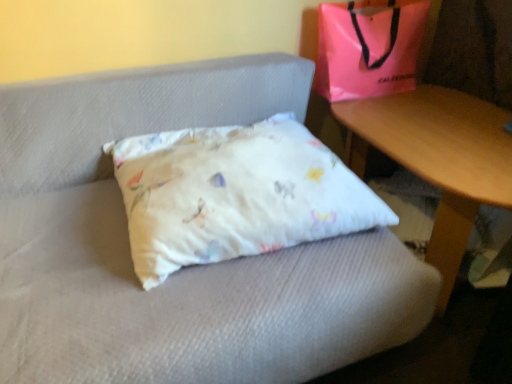
Question: Considering the relative sizes of wooden table at lower right and white cotton pillow at center in the image provided, is wooden table at lower right bigger than white cotton pillow at center?

Choices:
 (A) yes
 (B) no

Answer: (A)

Question: From a real-world perspective, is wooden table at lower right located beneath white cotton pillow at center?

Choices:
 (A) yes
 (B) no

Answer: (A)

Question: Is the position of wooden table at lower right more distant than that of white cotton pillow at center?

Choices:
 (A) yes
 (B) no

Answer: (A)

Question: Is white cotton pillow at center surrounded by wooden table at lower right?

Choices:
 (A) no
 (B) yes

Answer: (A)

Question: Does wooden table at lower right have a lesser height compared to white cotton pillow at center?

Choices:
 (A) no
 (B) yes

Answer: (A)

Question: Is wooden table at lower right wider or thinner than white cotton pillow at center?

Choices:
 (A) wide
 (B) thin

Answer: (B)

Question: Relative to white cotton pillow at center, is wooden table at lower right in front or behind?

Choices:
 (A) behind
 (B) front

Answer: (A)

Question: Do you think wooden table at lower right is within white cotton pillow at center, or outside of it?

Choices:
 (A) outside
 (B) inside

Answer: (A)

Question: Considering the positions of wooden table at lower right and white cotton pillow at center in the image, is wooden table at lower right taller or shorter than white cotton pillow at center?

Choices:
 (A) tall
 (B) short

Answer: (A)

Question: From a real-world perspective, is pink plastic bag at upper right positioned above or below white cotton pillow at center?

Choices:
 (A) above
 (B) below

Answer: (A)

Question: Is pink plastic bag at upper right taller or shorter than white cotton pillow at center?

Choices:
 (A) tall
 (B) short

Answer: (A)

Question: Based on their positions, is pink plastic bag at upper right located to the left or right of white cotton pillow at center?

Choices:
 (A) left
 (B) right

Answer: (B)

Question: From the image's perspective, relative to white cotton pillow at center, is pink plastic bag at upper right above or below?

Choices:
 (A) above
 (B) below

Answer: (A)

Question: Is point (348, 69) closer or farther from the camera than point (373, 114)?

Choices:
 (A) farther
 (B) closer

Answer: (A)

Question: Is pink plastic bag at upper right wider or thinner than wooden table at lower right?

Choices:
 (A) thin
 (B) wide

Answer: (A)